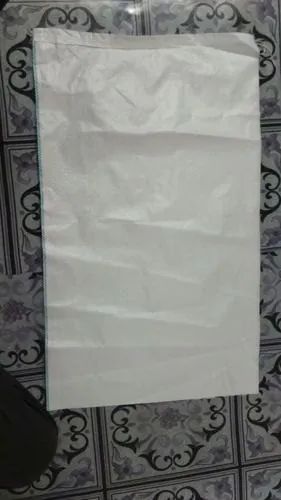
Identify the location of floor. (165, 439).